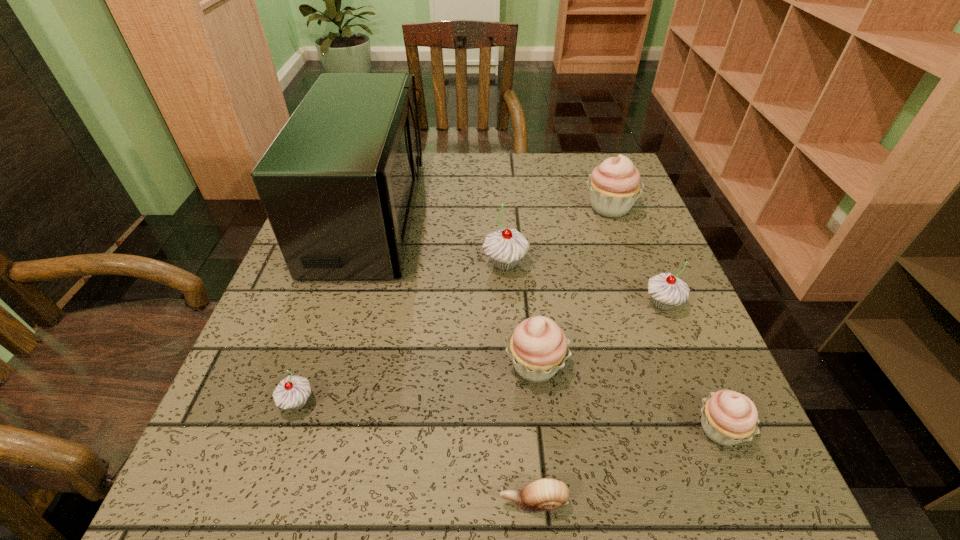
Identify which cupcake is the second closest to the escargot. Please provide its 2D coordinates. Your answer should be formatted as a tuple, i.e. [(x, y)], where the tuple contains the x and y coordinates of a point satisfying the conditions above.

[(728, 417)]

Locate which cupcake is the third closest to the second biggest gray cupcake. Please provide its 2D coordinates. Your answer should be formatted as a tuple, i.e. [(x, y)], where the tuple contains the x and y coordinates of a point satisfying the conditions above.

[(614, 185)]

The width and height of the screenshot is (960, 540). I want to click on pink cupcake that can be found as the closest to the rightmost gray cupcake, so click(538, 347).

Locate an element on the screen. The height and width of the screenshot is (540, 960). the second closest pink cupcake relative to the leftmost gray cupcake is located at coordinates (728, 417).

Locate which gray cupcake is the second closest to the escargot. Please provide its 2D coordinates. Your answer should be formatted as a tuple, i.e. [(x, y)], where the tuple contains the x and y coordinates of a point satisfying the conditions above.

[(666, 290)]

Find the location of a particular element. The width and height of the screenshot is (960, 540). gray cupcake that is the second nearest to the biggest gray cupcake is located at coordinates (292, 392).

Find the location of a particular element. The height and width of the screenshot is (540, 960). blank space that satisfies the following two spatial constraints: 1. on the front side of the farthest cupcake; 2. on the front-facing side of the escargot is located at coordinates (715, 502).

Find the location of a particular element. vacant area in the image that satisfies the following two spatial constraints: 1. on the front-facing side of the grey microwave_oven; 2. on the left side of the third farthest cupcake is located at coordinates (343, 304).